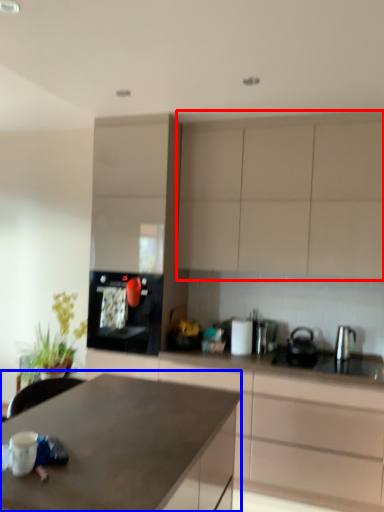
Question: Which of the following is the closest to the observer, cabinetry (highlighted by a red box) or countertop (highlighted by a blue box)?

Choices:
 (A) cabinetry
 (B) countertop

Answer: (B)